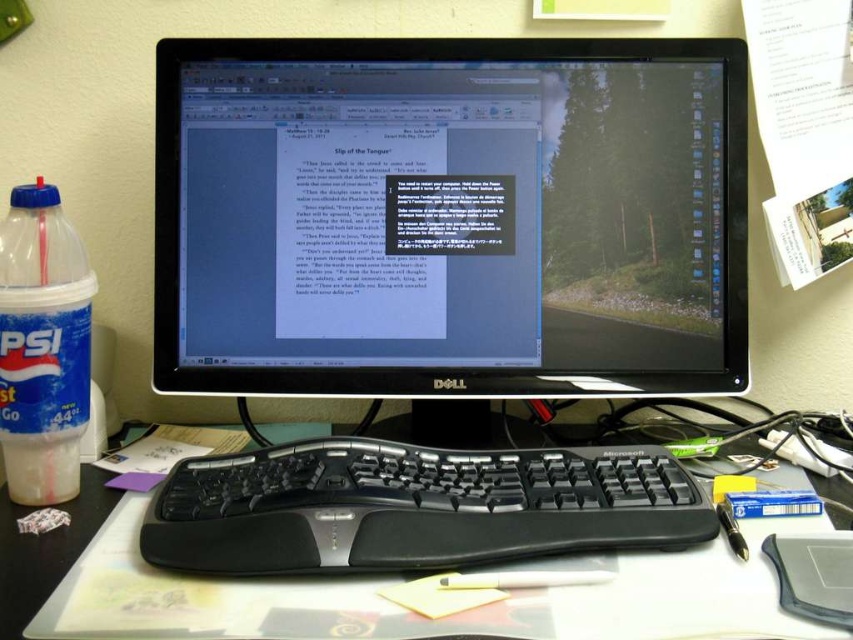
Question: Which point is farther to the camera?

Choices:
 (A) black plastic mouse at lower right
 (B) black glossy monitor at center
 (C) translucent plastic bottle at left

Answer: (B)

Question: Considering the relative positions of black glossy monitor at center and white plastic keyboard at center in the image provided, where is black glossy monitor at center located with respect to white plastic keyboard at center?

Choices:
 (A) above
 (B) below

Answer: (A)

Question: Observing the image, what is the correct spatial positioning of white plastic keyboard at center in reference to black plastic mouse at lower right?

Choices:
 (A) below
 (B) above

Answer: (B)

Question: Which object is closer to the camera taking this photo?

Choices:
 (A) translucent plastic bottle at left
 (B) white plastic keyboard at center
 (C) black glossy monitor at center
 (D) black plastic keyboard at center

Answer: (B)

Question: Does black glossy monitor at center appear over translucent plastic bottle at left?

Choices:
 (A) no
 (B) yes

Answer: (B)

Question: Which of the following is the closest to the observer?

Choices:
 (A) black plastic keyboard at center
 (B) white plastic keyboard at center
 (C) black plastic mouse at lower right
 (D) black glossy monitor at center

Answer: (B)